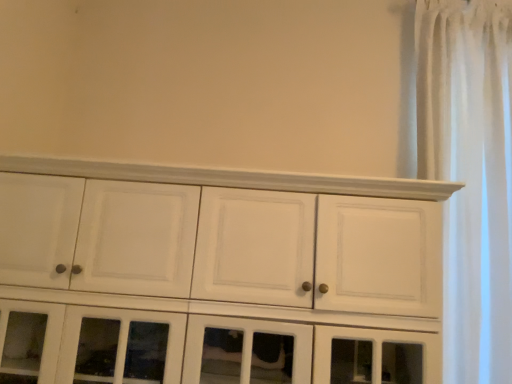
The image size is (512, 384). What do you see at coordinates (214, 274) in the screenshot?
I see `white painted wood cupboard at center` at bounding box center [214, 274].

Locate an element on the screen. Image resolution: width=512 pixels, height=384 pixels. white painted wood cupboard at center is located at coordinates coord(214,274).

This screenshot has width=512, height=384. Describe the element at coordinates (470, 175) in the screenshot. I see `white sheer curtain at right` at that location.

The height and width of the screenshot is (384, 512). Identify the location of white sheer curtain at right. (470, 175).

What is the approximate width of white sheer curtain at right?

The width of white sheer curtain at right is 9.98 inches.

In order to click on white painted wood cupboard at center in this screenshot , I will do `click(214, 274)`.

From the picture: In the image, is white sheer curtain at right on the left side or the right side of white painted wood cupboard at center?

Based on their positions, white sheer curtain at right is located to the right of white painted wood cupboard at center.

Considering their positions, is white sheer curtain at right located in front of or behind white painted wood cupboard at center?

In the image, white sheer curtain at right appears behind white painted wood cupboard at center.

Which is in front, point (507, 293) or point (201, 233)?

Positioned in front is point (201, 233).

From the image's perspective, is white sheer curtain at right on white painted wood cupboard at center?

Yes, from the image's perspective, white sheer curtain at right is over white painted wood cupboard at center.

From a real-world perspective, is white sheer curtain at right located beneath white painted wood cupboard at center?

No, from a real-world perspective, white sheer curtain at right is not beneath white painted wood cupboard at center.

Considering the sizes of objects white sheer curtain at right and white painted wood cupboard at center in the image provided, who is wider, white sheer curtain at right or white painted wood cupboard at center?

Wider between the two is white painted wood cupboard at center.

Is white sheer curtain at right shorter than white painted wood cupboard at center?

No.

Between white sheer curtain at right and white painted wood cupboard at center, which one has smaller size?

white sheer curtain at right is smaller.

Which is correct: white sheer curtain at right is inside white painted wood cupboard at center, or outside of it?

white sheer curtain at right is spatially situated outside white painted wood cupboard at center.

Is white sheer curtain at right beside white painted wood cupboard at center?

white sheer curtain at right is not next to white painted wood cupboard at center, and they're not touching.

Is white sheer curtain at right oriented towards white painted wood cupboard at center?

No, white sheer curtain at right is not turned towards white painted wood cupboard at center.

Can you tell me how much white sheer curtain at right and white painted wood cupboard at center differ in facing direction?

There is a 0.457-degree angle between the facing directions of white sheer curtain at right and white painted wood cupboard at center.

Locate an element on the screen. Image resolution: width=512 pixels, height=384 pixels. shower curtain that appears above the white painted wood cupboard at center (from the image's perspective) is located at coordinates (470, 175).

Considering the positions of objects white painted wood cupboard at center and white sheer curtain at right in the image provided, who is more to the left, white painted wood cupboard at center or white sheer curtain at right?

From the viewer's perspective, white painted wood cupboard at center appears more on the left side.

Which is behind, white painted wood cupboard at center or white sheer curtain at right?

white sheer curtain at right is further away from the camera.

Does point (179, 246) appear closer or farther from the camera than point (462, 62)?

Point (179, 246) appears to be closer to the viewer than point (462, 62).

From the image's perspective, which one is positioned lower, white painted wood cupboard at center or white sheer curtain at right?

white painted wood cupboard at center, from the image's perspective.

From a real-world perspective, is white painted wood cupboard at center under white sheer curtain at right?

Yes, from a real-world perspective, white painted wood cupboard at center is beneath white sheer curtain at right.

Is white painted wood cupboard at center wider or thinner than white sheer curtain at right?

In the image, white painted wood cupboard at center appears to be wider than white sheer curtain at right.

Who is shorter, white painted wood cupboard at center or white sheer curtain at right?

white painted wood cupboard at center.

Can you confirm if white painted wood cupboard at center is bigger than white sheer curtain at right?

Yes.

Which is correct: white painted wood cupboard at center is inside white sheer curtain at right, or outside of it?

white painted wood cupboard at center is not enclosed by white sheer curtain at right.

From the picture: Are white painted wood cupboard at center and white sheer curtain at right far apart?

Actually, white painted wood cupboard at center and white sheer curtain at right are a little close together.

Is white painted wood cupboard at center looking in the opposite direction of white sheer curtain at right?

That's not correct — white painted wood cupboard at center is not looking away from white sheer curtain at right.

This screenshot has width=512, height=384. Find the location of `shower curtain located behind the white painted wood cupboard at center`. shower curtain located behind the white painted wood cupboard at center is located at coordinates (470, 175).

In order to click on shower curtain above the white painted wood cupboard at center (from the image's perspective) in this screenshot , I will do `click(470, 175)`.

Where is `cupboard that is under the white sheer curtain at right (from a real-world perspective)`? cupboard that is under the white sheer curtain at right (from a real-world perspective) is located at coordinates [214, 274].